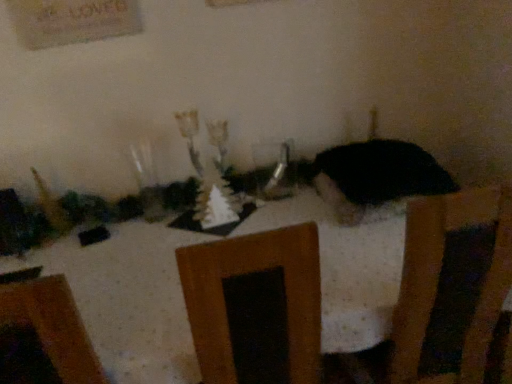
Question: Is black matte cat at center spatially inside white dotted tablecloth at center, or outside of it?

Choices:
 (A) inside
 (B) outside

Answer: (B)

Question: Does point (407, 150) appear closer or farther from the camera than point (93, 329)?

Choices:
 (A) farther
 (B) closer

Answer: (A)

Question: Estimate the real-world distances between objects in this image. Which object is closer to the clear glass vase at center?

Choices:
 (A) white dotted tablecloth at center
 (B) black matte cat at center

Answer: (B)

Question: Which object is the closest to the black matte cat at center?

Choices:
 (A) clear glass vase at center
 (B) white dotted tablecloth at center

Answer: (A)